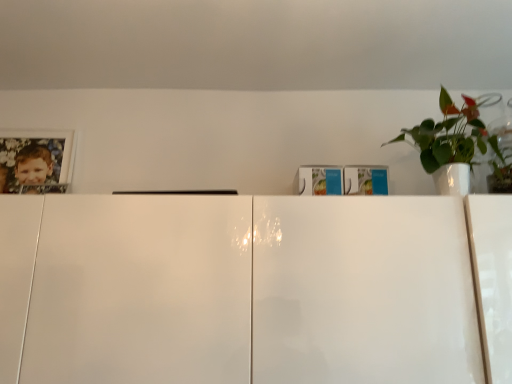
Question: Would you say white glossy picture frame at upper left is inside or outside white glossy pot at upper right?

Choices:
 (A) outside
 (B) inside

Answer: (A)

Question: In terms of height, does white glossy picture frame at upper left look taller or shorter compared to white glossy pot at upper right?

Choices:
 (A) tall
 (B) short

Answer: (A)

Question: Looking at the image, does white glossy picture frame at upper left seem bigger or smaller compared to white glossy pot at upper right?

Choices:
 (A) big
 (B) small

Answer: (B)

Question: In the image, is white glossy pot at upper right positioned in front of or behind white glossy picture frame at upper left?

Choices:
 (A) front
 (B) behind

Answer: (A)

Question: In terms of height, does white glossy pot at upper right look taller or shorter compared to white glossy picture frame at upper left?

Choices:
 (A) tall
 (B) short

Answer: (B)

Question: Is white glossy pot at upper right to the left or to the right of white glossy picture frame at upper left in the image?

Choices:
 (A) right
 (B) left

Answer: (A)

Question: From the image's perspective, is white glossy pot at upper right positioned above or below white glossy picture frame at upper left?

Choices:
 (A) below
 (B) above

Answer: (B)